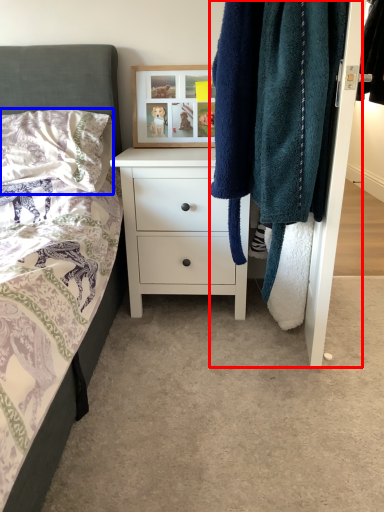
Question: Which point is further to the camera, closet (highlighted by a red box) or pillow (highlighted by a blue box)?

Choices:
 (A) closet
 (B) pillow

Answer: (B)